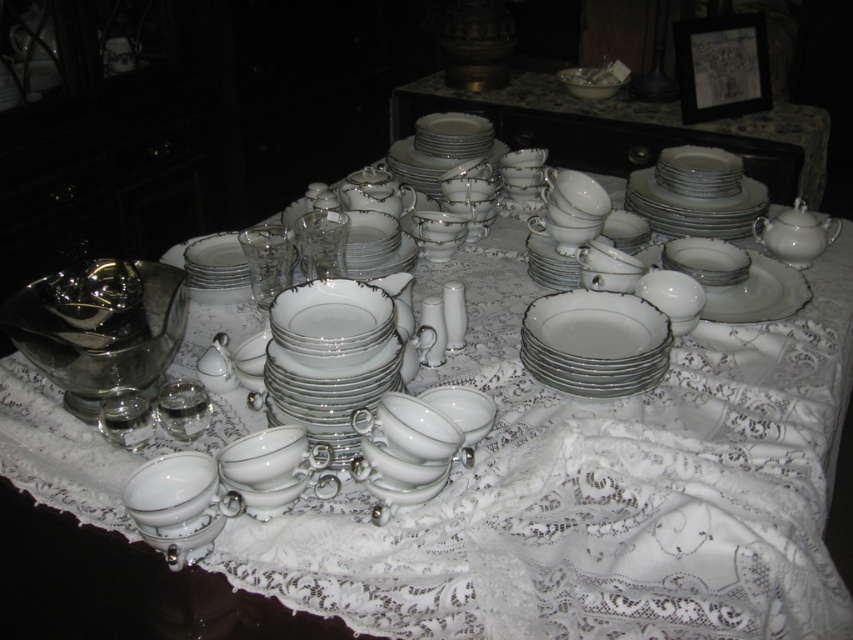
Is white porcelain plates at upper center wider than white porcelain platter at center?

Indeed, white porcelain plates at upper center has a greater width compared to white porcelain platter at center.

Based on the photo, is white porcelain plates at upper center behind white porcelain platter at center?

Yes, it is.

Where is `white porcelain plates at upper center`? white porcelain plates at upper center is located at coordinates (630, 129).

Identify the location of white porcelain plates at upper center. The image size is (853, 640). (630, 129).

Measure the distance between white porcelain plates at upper center and white porcelain platter at upper right.

They are 37.67 inches apart.

What do you see at coordinates (630, 129) in the screenshot?
I see `white porcelain plates at upper center` at bounding box center [630, 129].

I want to click on white porcelain plates at upper center, so click(x=630, y=129).

Does white porcelain plates at upper center have a greater width compared to white porcelain plate at center?

Yes, white porcelain plates at upper center is wider than white porcelain plate at center.

Does white porcelain plates at upper center have a lesser width compared to white porcelain plate at center?

No.

At what (x,y) coordinates should I click in order to perform the action: click on white porcelain plates at upper center. Please return your answer as a coordinate pair (x, y). The width and height of the screenshot is (853, 640). Looking at the image, I should click on (630, 129).

At what (x,y) coordinates should I click in order to perform the action: click on white porcelain plates at upper center. Please return your answer as a coordinate pair (x, y). Looking at the image, I should click on (630, 129).